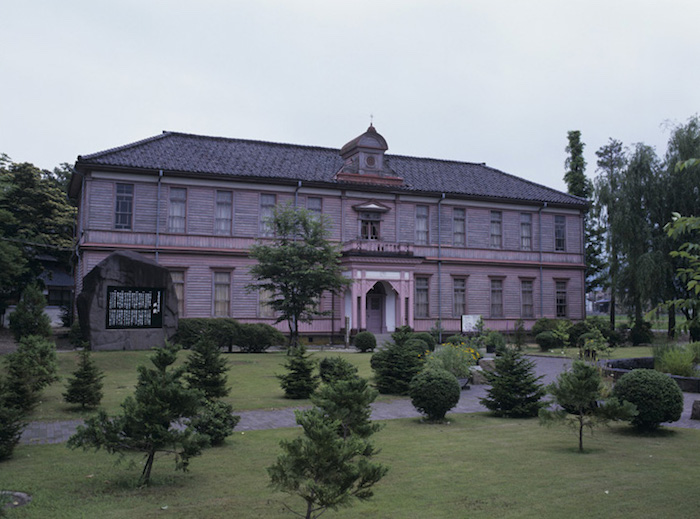
This screenshot has height=519, width=700. Find the location of `entrance`. entrance is located at coordinates (381, 307).